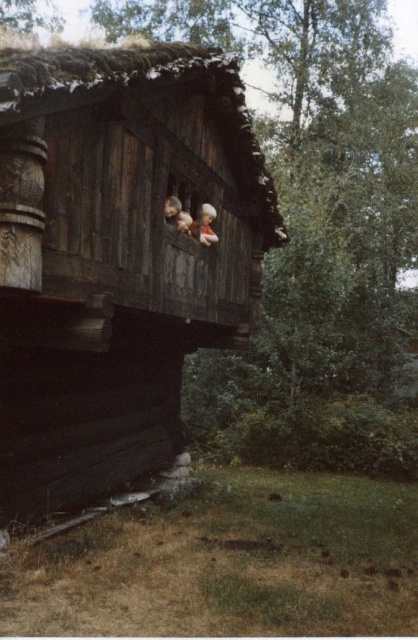
Question: Which point is closer to the camera?

Choices:
 (A) (17, 154)
 (B) (204, 225)

Answer: (A)

Question: In this image, where is dark brown wooden log cabin at center located relative to smooth wooden doll at upper center?

Choices:
 (A) left
 (B) right

Answer: (A)

Question: Can you confirm if dark brown wooden log cabin at center is positioned below smooth wooden doll at upper center?

Choices:
 (A) no
 (B) yes

Answer: (A)

Question: Among these objects, which one is farthest from the camera?

Choices:
 (A) dark brown wooden log cabin at center
 (B) smooth wooden doll at upper center

Answer: (B)

Question: Does dark brown wooden log cabin at center lie in front of smooth wooden doll at upper center?

Choices:
 (A) yes
 (B) no

Answer: (A)